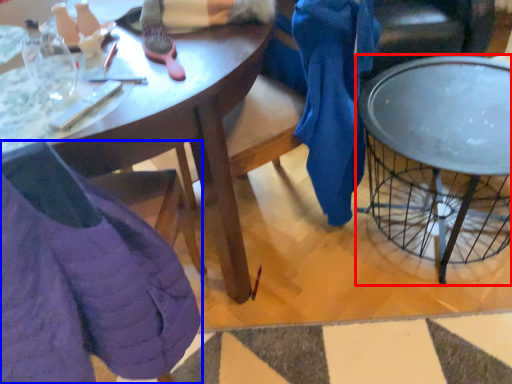
Question: Which point is closer to the camera, coffee table (highlighted by a red box) or chair (highlighted by a blue box)?

Choices:
 (A) coffee table
 (B) chair

Answer: (B)